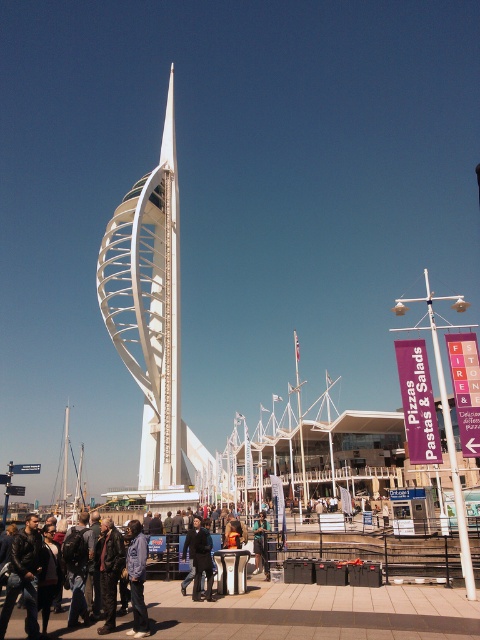
Question: Which point is closer to the camera?

Choices:
 (A) coord(200,536)
 (B) coord(257,556)
 (C) coord(132,625)

Answer: (C)

Question: Does white metallic spire at center have a greater width compared to dark blue jacket at center?

Choices:
 (A) no
 (B) yes

Answer: (B)

Question: Is white metallic spire at center in front of dark blue jacket at center?

Choices:
 (A) yes
 (B) no

Answer: (B)

Question: Considering the real-world distances, which object is farthest from the denim jacket at center?

Choices:
 (A) denim jacket at lower left
 (B) white metallic spire at center
 (C) dark blue jacket at center

Answer: (B)

Question: Is white metallic spire at center smaller than denim jacket at center?

Choices:
 (A) yes
 (B) no

Answer: (B)

Question: Which point appears closest to the camera in this image?

Choices:
 (A) (145, 609)
 (B) (207, 596)
 (C) (257, 556)

Answer: (A)